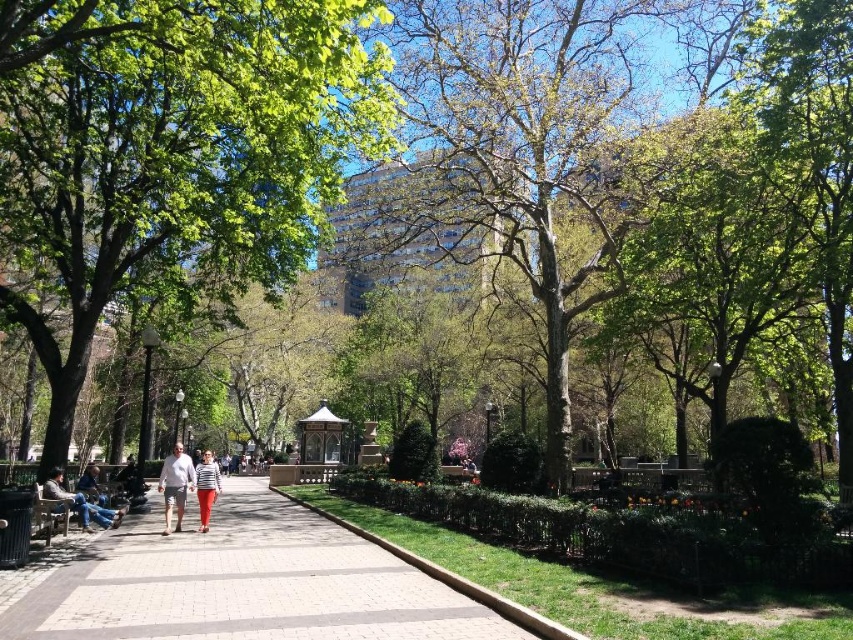
Between wooden park bench at lower left and striped fabric pants at center, which one is positioned lower?

striped fabric pants at center

Between wooden park bench at lower left and striped fabric pants at center, which one appears on the left side from the viewer's perspective?

striped fabric pants at center

Is point (57, 509) less distant than point (204, 483)?

Yes.

Where is `wooden park bench at lower left`? This screenshot has width=853, height=640. wooden park bench at lower left is located at coordinates pyautogui.click(x=48, y=513).

Which is above, denim pants at left or striped fabric pants at center?

denim pants at left

Is point (73, 497) positioned behind point (196, 470)?

That is False.

The height and width of the screenshot is (640, 853). What are the coordinates of `denim pants at left` in the screenshot? It's located at (79, 502).

Can you confirm if smooth concrete path at center is shorter than light gray shorts at center?

Indeed, smooth concrete path at center has a lesser height compared to light gray shorts at center.

Can you confirm if smooth concrete path at center is positioned above light gray shorts at center?

Yes, smooth concrete path at center is above light gray shorts at center.

Find the location of a particular element. smooth concrete path at center is located at coordinates (245, 582).